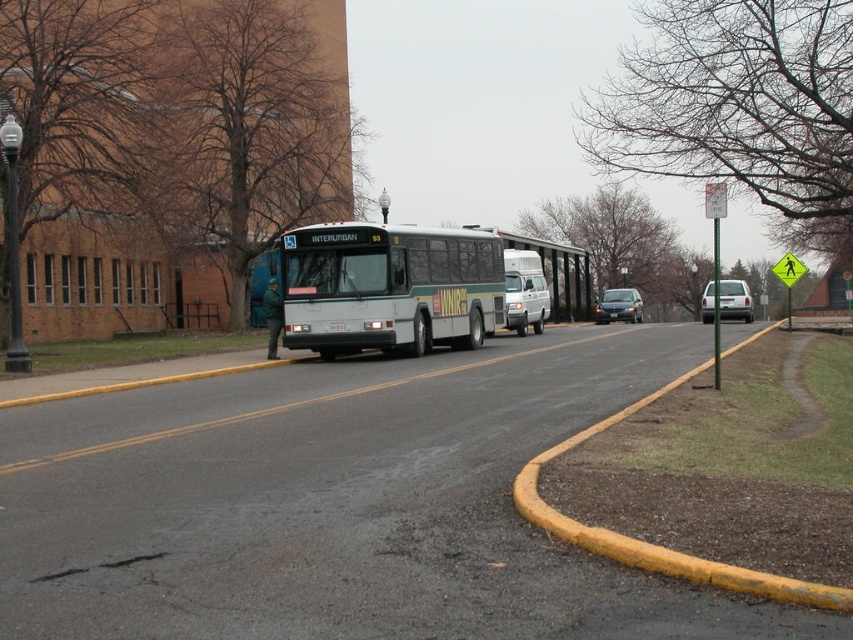
You are a delivery driver who needs to park your car between the silver metallic sedan at right and the metallic silver sedan at center. Is there enough space between them to park your car?

The silver metallic sedan at right is to the right of the metallic silver sedan at center, so there is space between them. However, without knowing the exact distance between the two sedans, it is impossible to determine if there is enough space for your car.

Looking at this image, you are a delivery person who needs to load a package onto the roof of the white matte bus at center and the white matte van at center. Which vehicle should you choose if you want to place the package on the vehicle that is taller?

The white matte bus at center is taller than the white matte van at center, so you should choose the white matte bus at center to place the package on its roof.

You are a pedestrian standing on the sidewalk next to the curb. You see the white matte bus at center and the white matte van at center. Which vehicle is closer to the curb?

The white matte bus at center is closer to the curb because it is positioned under the white matte van at center, meaning it is in front and nearer to the curb.